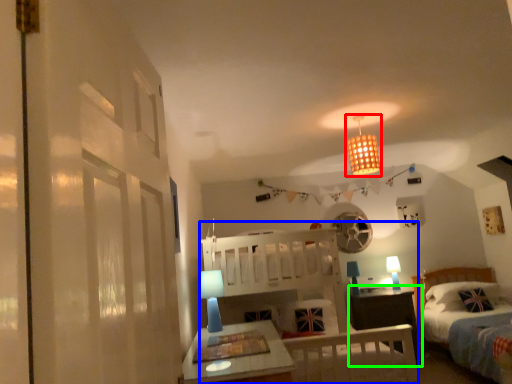
Question: Which object is the farthest from light fixture (highlighted by a red box)? Choose among these: bunk bed (highlighted by a blue box) or nightstand (highlighted by a green box).

Choices:
 (A) bunk bed
 (B) nightstand

Answer: (B)